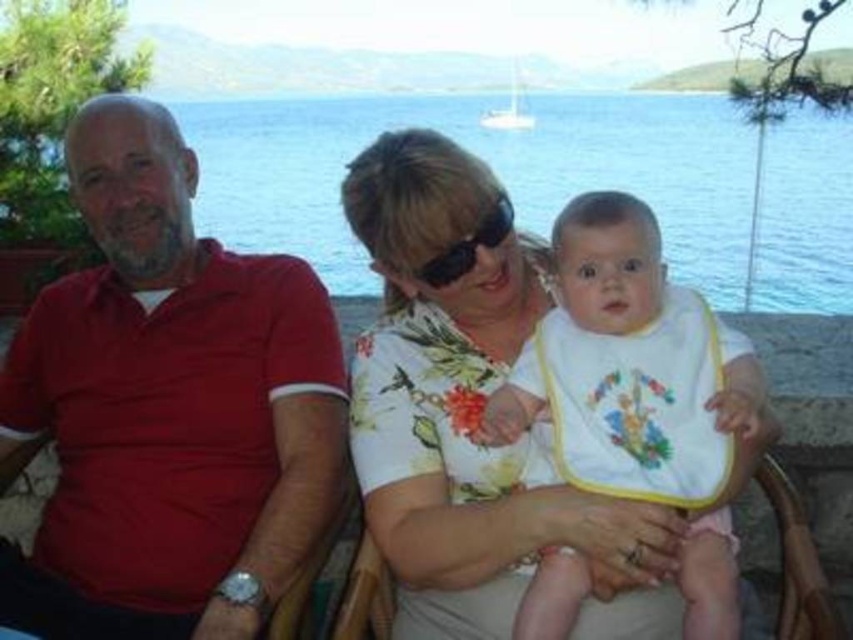
Between point (62, 477) and point (566, 216), which one is positioned behind?

The point (62, 477) is behind.

Does point (106, 456) come behind point (686, 563)?

Yes.

Where is `matte red polo shirt at left`? This screenshot has width=853, height=640. matte red polo shirt at left is located at coordinates (167, 406).

Who is taller, matte red polo shirt at left or blue water at center?

With more height is blue water at center.

Which is more to the left, matte red polo shirt at left or blue water at center?

matte red polo shirt at left

Image resolution: width=853 pixels, height=640 pixels. In order to click on matte red polo shirt at left in this screenshot , I will do `click(167, 406)`.

Does blue water at center have a lesser width compared to white cotton bib at center?

No, blue water at center is not thinner than white cotton bib at center.

Is the position of blue water at center more distant than that of white cotton bib at center?

Yes, blue water at center is further from the viewer.

At what (x,y) coordinates should I click in order to perform the action: click on blue water at center. Please return your answer as a coordinate pair (x, y). The width and height of the screenshot is (853, 640). Looking at the image, I should click on pyautogui.click(x=489, y=163).

Identify the location of blue water at center. (489, 163).